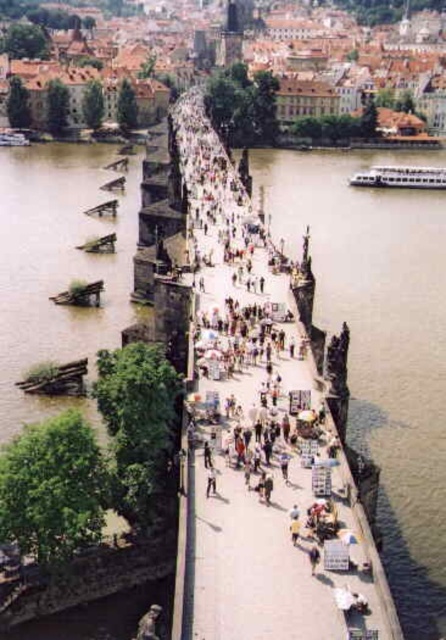
You are standing on the Charles Bridge in Prague and want to take a photo of the point at coordinates [337,275]. If your camera can focus on objects up to 400 feet away, will it be able to capture that point clearly?

The point at coordinates [337,275] is 371.14 feet away from the camera, which is within the camera maximum focus range of 400 feet. Therefore, the camera can capture the point clearly.

You are a tourist standing on the Charles Bridge in Prague. You notice the brown water at lower right and the dark gray stone statue at center. Which of these two objects is wider in terms of their visual representation in the image?

The brown water at lower right is wider than the dark gray stone statue at center according to the description.